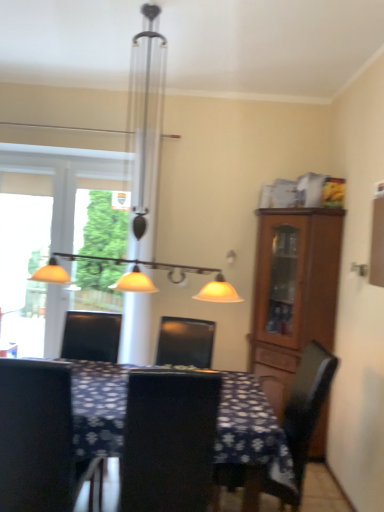
Question: From the image's perspective, is transparent glass window at left positioned above or below matte metal chandelier at upper center?

Choices:
 (A) above
 (B) below

Answer: (B)

Question: From a real-world perspective, is transparent glass window at left positioned above or below matte metal chandelier at upper center?

Choices:
 (A) below
 (B) above

Answer: (A)

Question: Which object is positioned closest to the dark brown wooden chair at right, positioned as the first chair in right-to-left order?

Choices:
 (A) matte metal chandelier at upper center
 (B) brown wooden cabinet at right
 (C) dark blue fabric table at center
 (D) black matte chair at left, marked as the 1th chair in a left-to-right arrangement
 (E) black leather chair at center, the second chair viewed from the left

Answer: (C)

Question: Considering the real-world distances, which object is closest to the matte metal chandelier at upper center?

Choices:
 (A) transparent glass window at left
 (B) brown wooden cabinet at right
 (C) dark brown wooden chair at right, the 3th chair when ordered from left to right
 (D) black leather chair at center, the second chair viewed from the left
 (E) dark blue fabric table at center

Answer: (B)